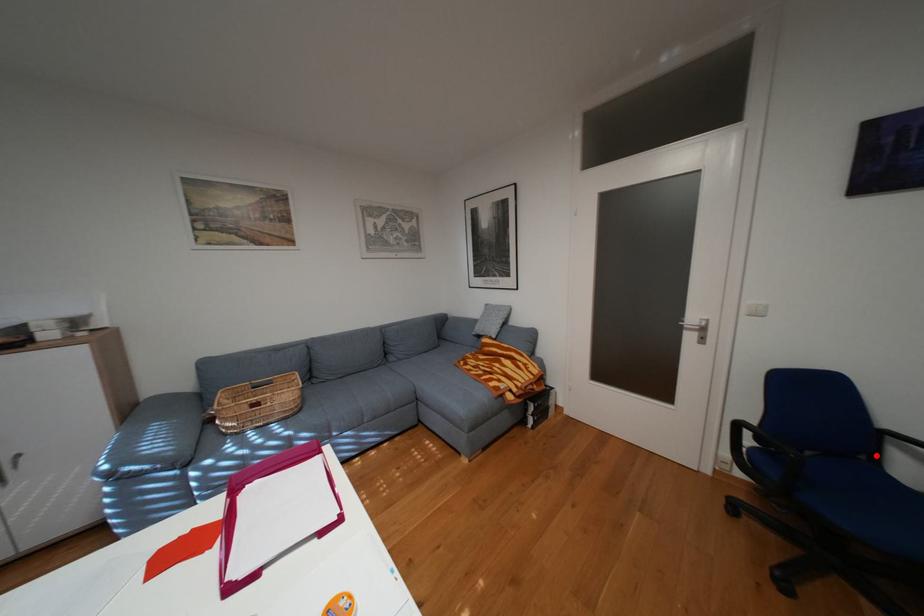
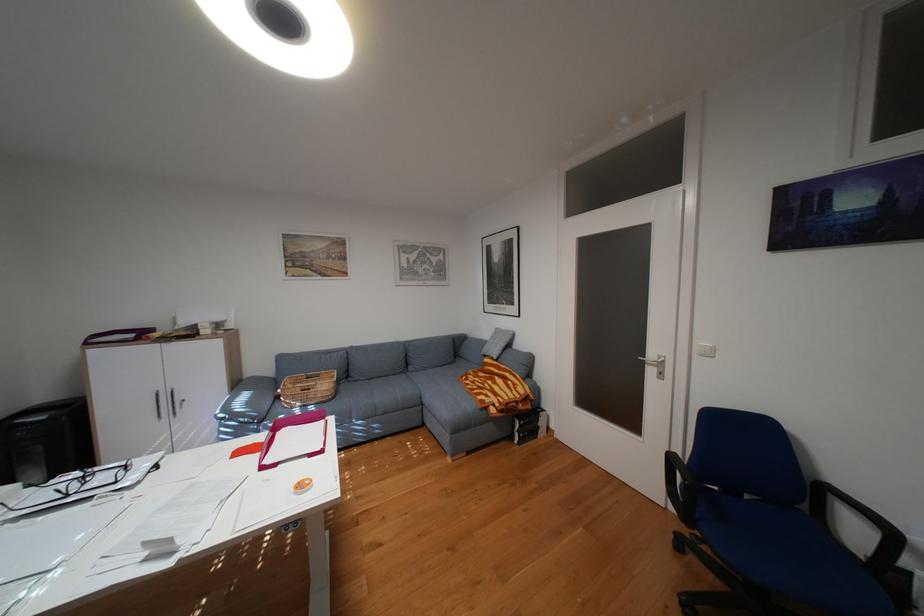
Find the pixel in the second image that matches the highlighted location in the first image.

(817, 508)